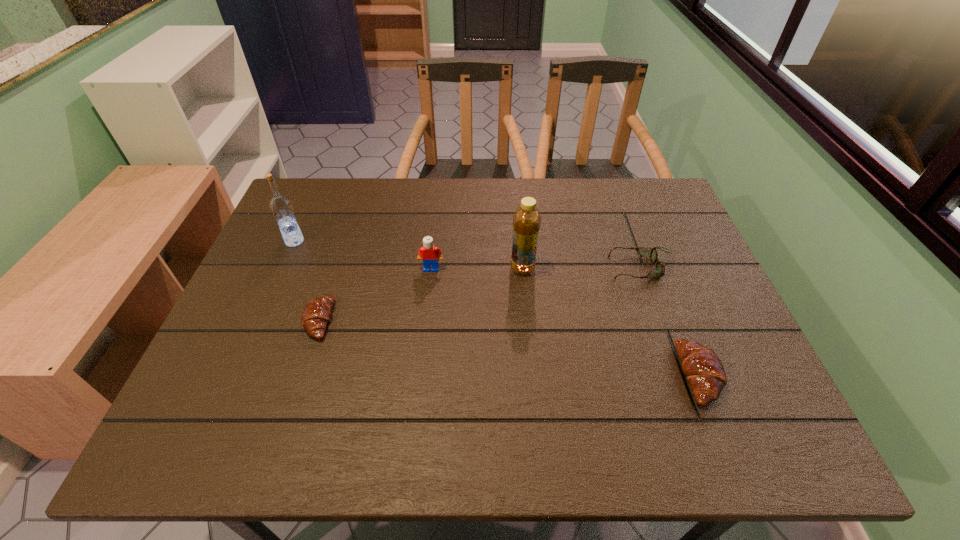
I want to click on vacant spot for a new crescent_roll to ensure equal spacing, so (x=499, y=346).